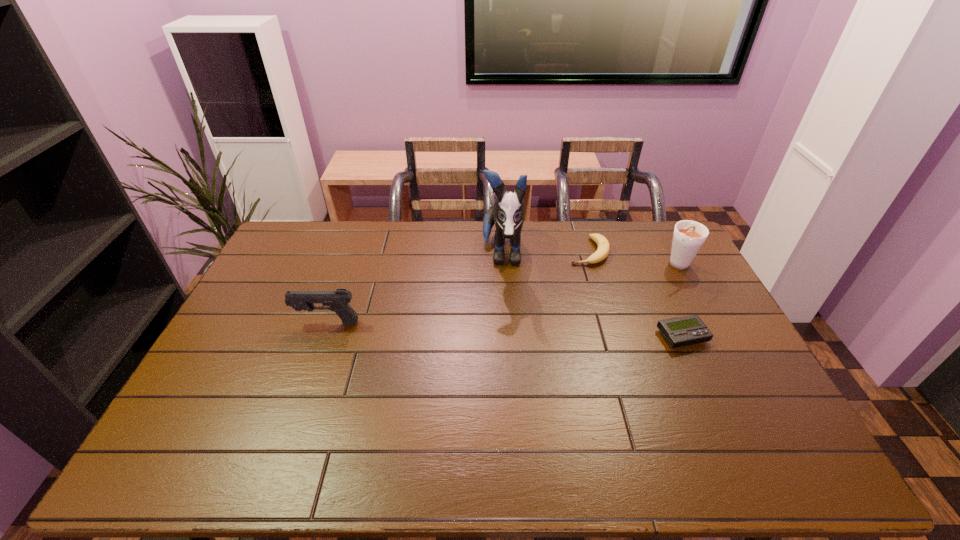
This screenshot has width=960, height=540. Identify the location of vacant space on the desktop that is between the pistol and the beeper and is positioned on the front-facing side of the tallest object. (500, 329).

At what (x,y) coordinates should I click in order to perform the action: click on vacant space on the desktop that is between the leftmost object and the beeper and is positioned at the stem of the third object from left to right. Please return your answer as a coordinate pair (x, y). Looking at the image, I should click on (548, 331).

Image resolution: width=960 pixels, height=540 pixels. I want to click on free space on the desktop that is between the third tallest object and the beeper and is positioned on the drink side of the fourth shortest object, so click(x=554, y=332).